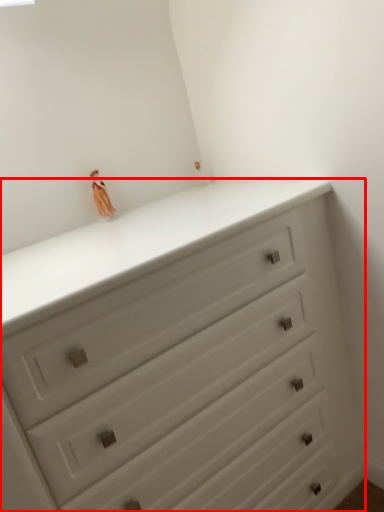
Question: From the image, what is the correct spatial relationship of chest of drawers (annotated by the red box) in relation to miniature?

Choices:
 (A) right
 (B) left

Answer: (A)